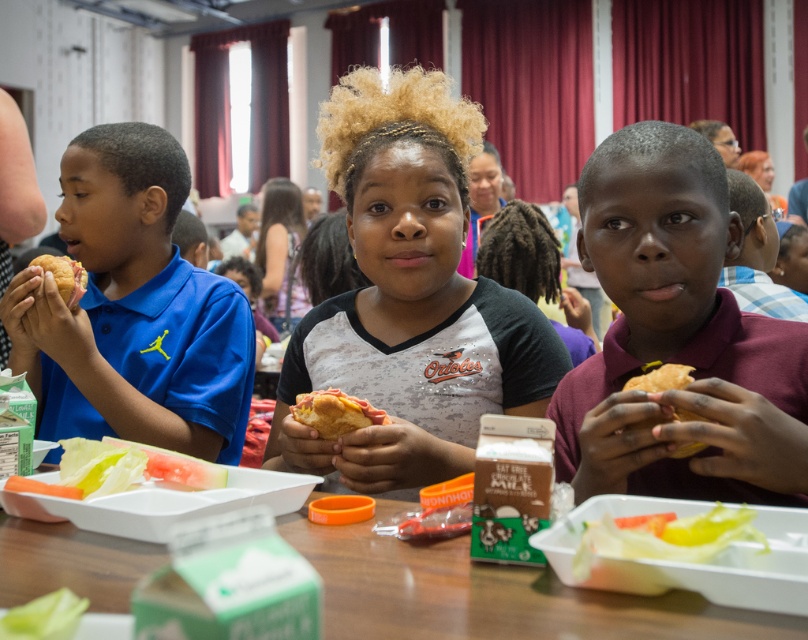
Question: Which point is farther to the camera?

Choices:
 (A) (339, 429)
 (B) (445, 580)
 (C) (676, 410)
 (D) (127, 465)

Answer: (A)

Question: Is translucent plastic tray at lower left to the right of golden crispy bread at right from the viewer's perspective?

Choices:
 (A) yes
 (B) no

Answer: (B)

Question: Which object appears farthest from the camera in this image?

Choices:
 (A) golden crispy bread at right
 (B) green cardboard milk carton at lower center
 (C) translucent plastic lettuce at lower center
 (D) white jersey at center

Answer: (D)

Question: Does maroon jersey at right have a smaller size compared to golden crispy bread at right?

Choices:
 (A) yes
 (B) no

Answer: (B)

Question: Does translucent plastic lettuce at lower center appear over translucent plastic tray at lower left?

Choices:
 (A) no
 (B) yes

Answer: (A)

Question: Which point is closer to the camera?

Choices:
 (A) (676, 368)
 (B) (457, 577)

Answer: (B)